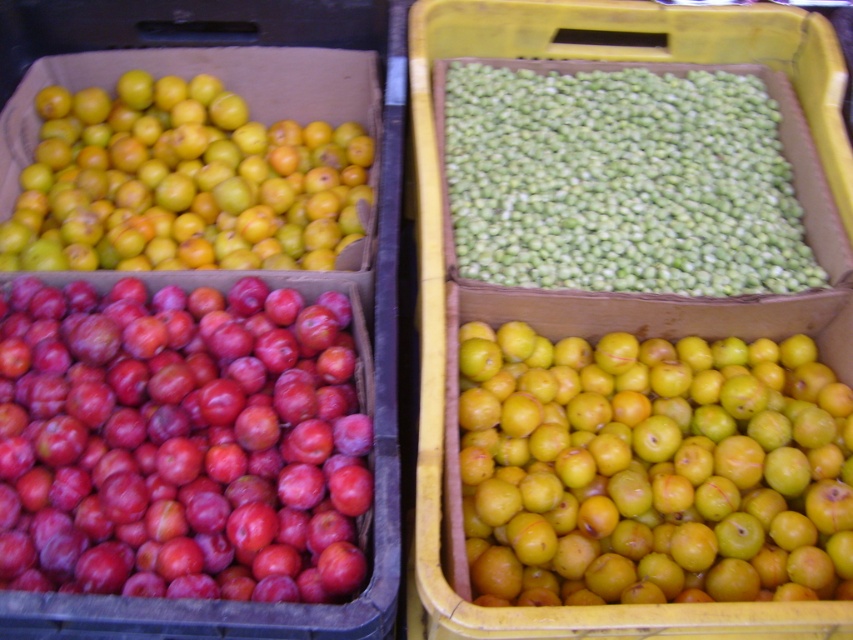
You are a customer at the market stall and want to pick up both the green matte beans at center and the matte cardboard box at left. Which one can you reach first without moving your position?

The green matte beans at center is closer to you than the matte cardboard box at left, so you can reach the green matte beans at center first without moving your position.

You are a customer at the market stall and want to pick up the yellow matte plums at center and the matte cardboard box at left. Which one should you lift first to access the other?

You should lift the matte cardboard box at left first because the yellow matte plums at center is positioned under it.